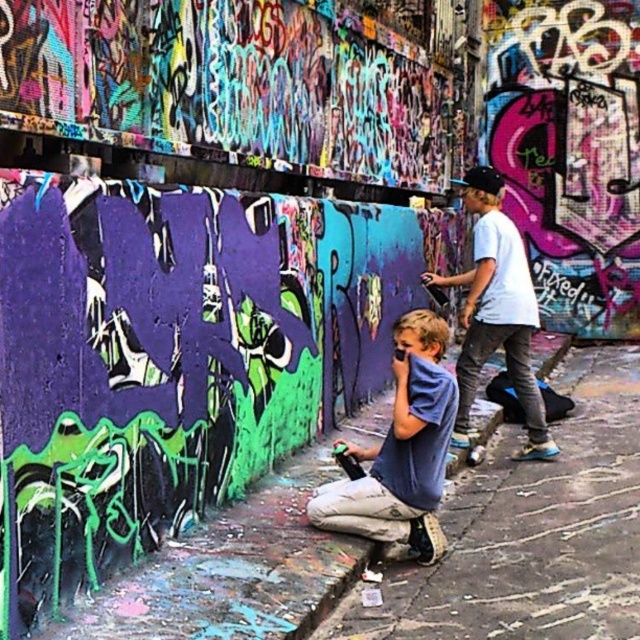
Question: Is matte blue t-shirt at center positioned behind light blue denim jeans at center?

Choices:
 (A) no
 (B) yes

Answer: (A)

Question: Is matte blue t-shirt at center smaller than light blue denim jeans at center?

Choices:
 (A) yes
 (B) no

Answer: (A)

Question: Which point is farther to the camera?

Choices:
 (A) (467, 307)
 (B) (330, 484)

Answer: (A)

Question: Can you confirm if matte blue t-shirt at center is positioned above light blue denim jeans at center?

Choices:
 (A) yes
 (B) no

Answer: (B)

Question: Among these points, which one is farthest from the camera?

Choices:
 (A) (464, 316)
 (B) (419, 384)

Answer: (A)

Question: Which object is closer to the camera taking this photo?

Choices:
 (A) matte blue t-shirt at center
 (B) light blue denim jeans at center

Answer: (A)